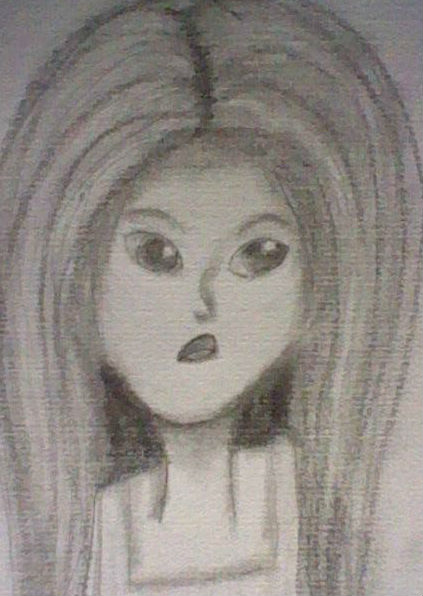
Image resolution: width=423 pixels, height=596 pixels. In order to click on canvas in this screenshot , I will do point(400,524).